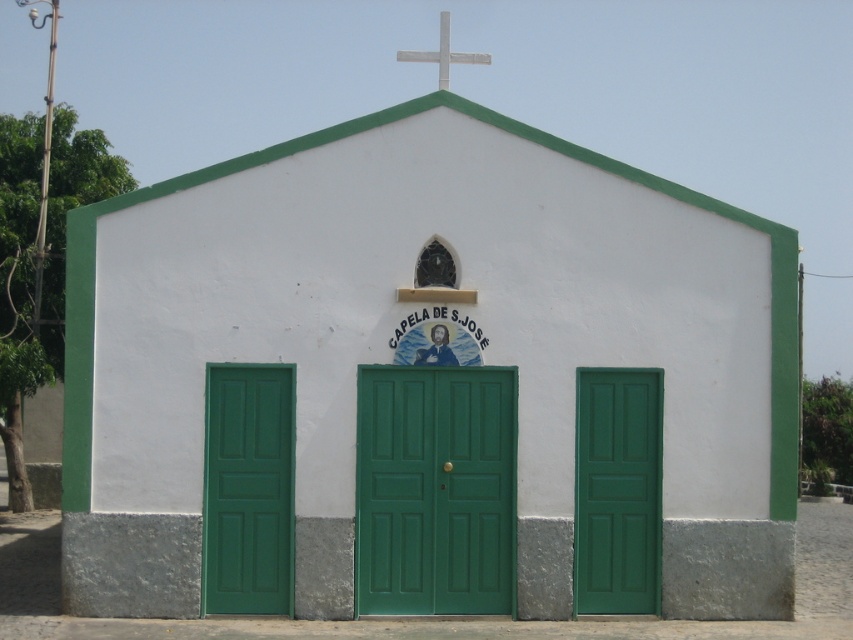
Can you confirm if green matte door at center is wider than white metallic cross at upper center?

Indeed, green matte door at center has a greater width compared to white metallic cross at upper center.

Can you confirm if green matte door at center is thinner than white metallic cross at upper center?

In fact, green matte door at center might be wider than white metallic cross at upper center.

Between point (514, 604) and point (477, 58), which one is positioned in front?

Point (514, 604) is in front.

You are a GUI agent. You are given a task and a screenshot of the screen. Output one action in this format:
    pyautogui.click(x=<x>, y=<y>)
    Task: Click on the green matte door at center
    
    Given the screenshot: What is the action you would take?
    pyautogui.click(x=434, y=490)

Who is more distant from viewer, (608, 525) or (439, 86)?

The point (439, 86) is behind.

Is green matte door at right further to the viewer compared to white metallic cross at upper center?

No, it is not.

The height and width of the screenshot is (640, 853). Find the location of `green matte door at right`. green matte door at right is located at coordinates (618, 490).

This screenshot has width=853, height=640. I want to click on green matte door at left, so click(248, 490).

Is point (209, 605) positioned before point (438, 67)?

Yes, point (209, 605) is closer to viewer.

You are a GUI agent. You are given a task and a screenshot of the screen. Output one action in this format:
    pyautogui.click(x=<x>, y=<y>)
    Task: Click on the green matte door at left
    The image size is (853, 640).
    Given the screenshot: What is the action you would take?
    pyautogui.click(x=248, y=490)